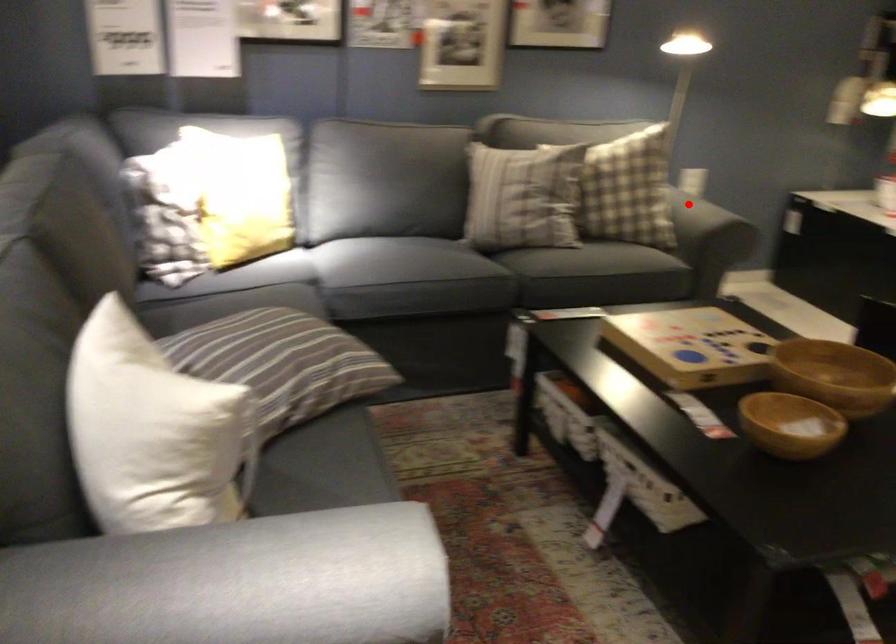
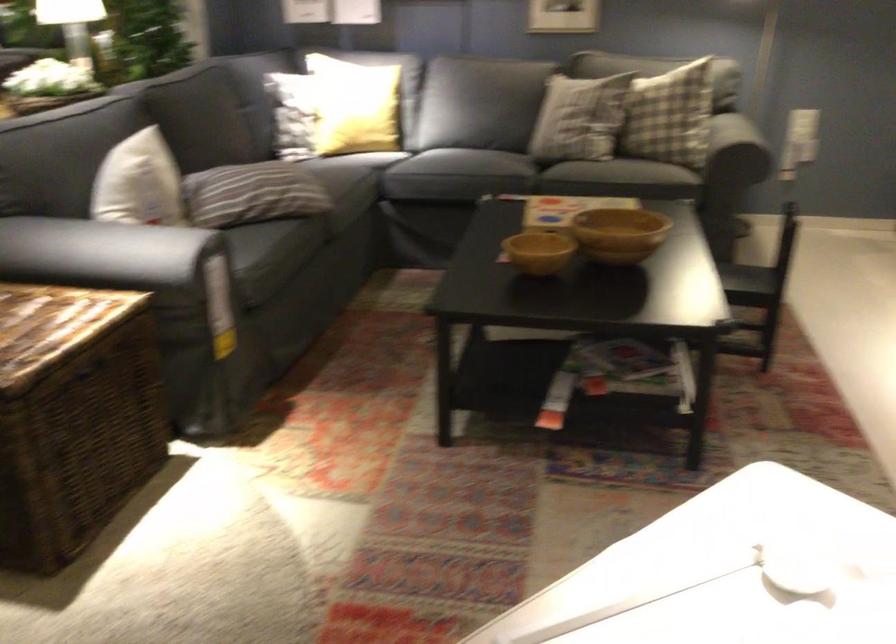
Question: A red point is marked in image1. In image2, is the corresponding 3D point closer to the camera or farther? Reply with the corresponding letter.

Choices:
 (A) The corresponding 3D point is closer.
 (B) The corresponding 3D point is farther.

Answer: (B)